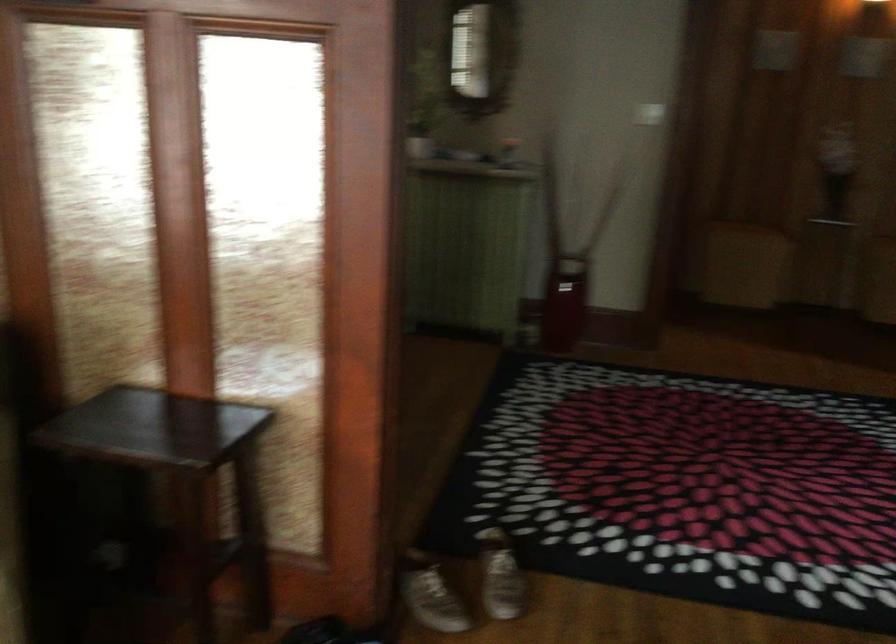
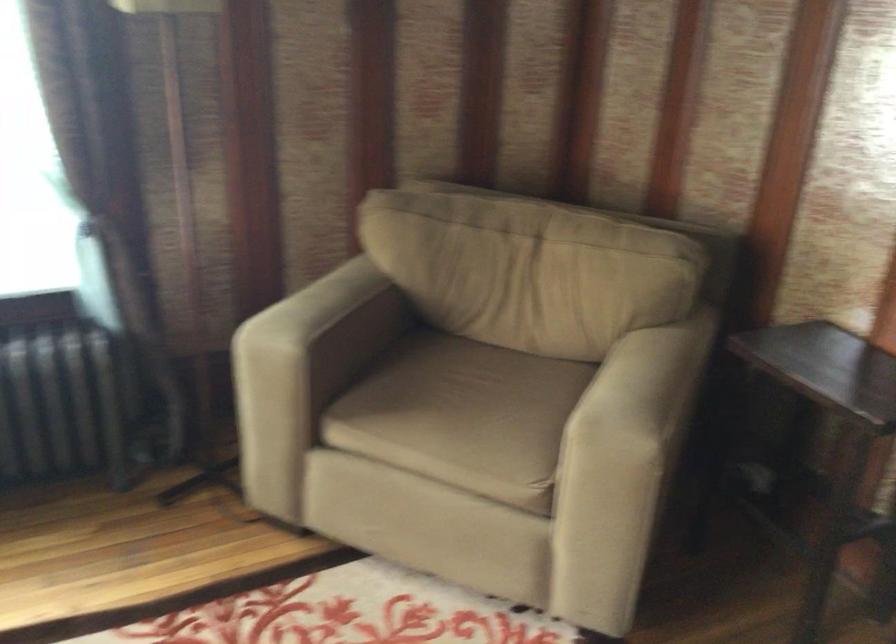
Question: The camera is either moving clockwise (left) or counter-clockwise (right) around the object. The first image is from the beginning of the video and the second image is from the end. Is the camera moving left or right when shooting the video?

Choices:
 (A) Left
 (B) Right

Answer: (B)